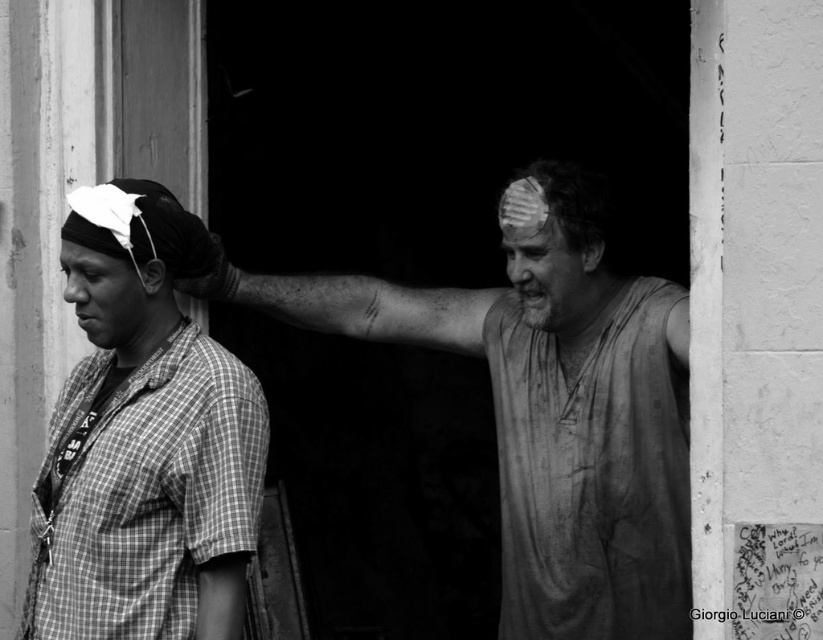
You are a photographer analyzing the composition of this black and white photo. You need to determine the exact location of the dirty white tank top at center in the image. What are its coordinates?

The dirty white tank top at center is located at coordinates point (551,410).

You are standing in an urban doorway and see the dirty white tank top at center. If you want to reach it without moving, can you do so?

The dirty white tank top at center is 4.54 meters away from you, so you cannot reach it without moving closer.

You are an observer looking at the photograph. You want to locate the dirty white tank top at center. Which coordinate point should you focus on?

The dirty white tank top at center is located at point (551, 410).